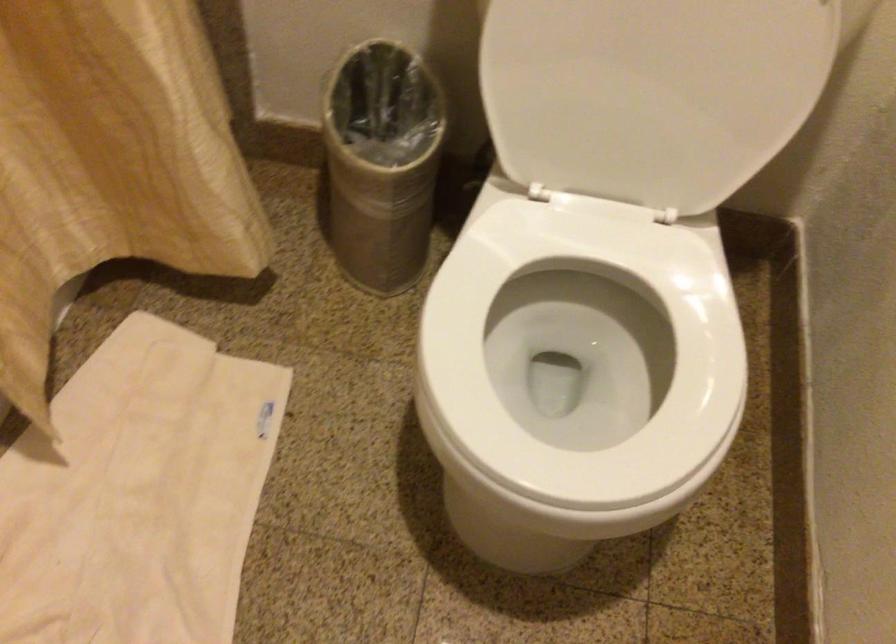
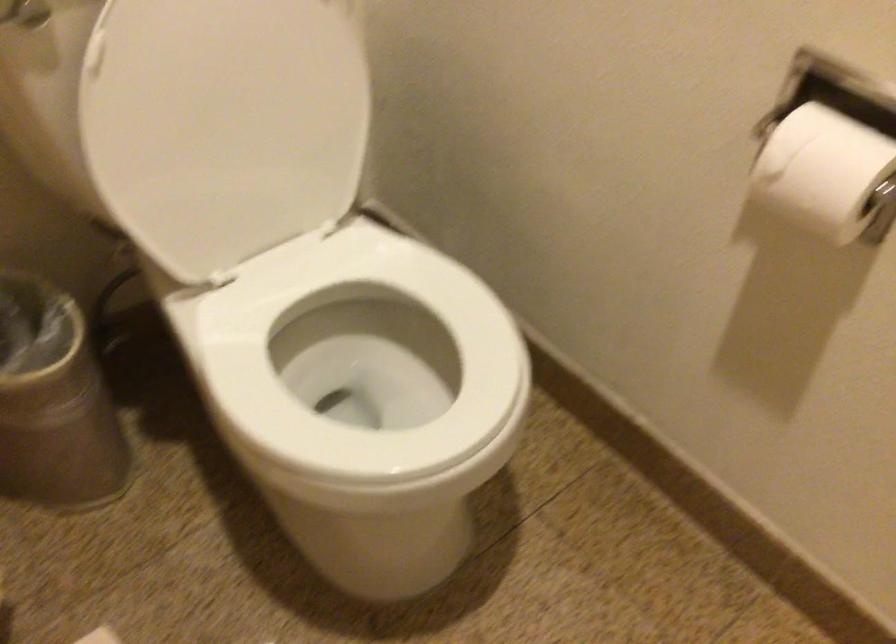
Locate, in the second image, the point that corresponds to the point at 366,192 in the first image.

(54, 402)